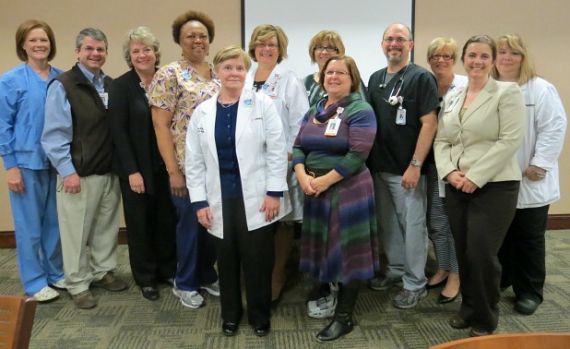
Image resolution: width=570 pixels, height=349 pixels. Identify the location of wall. (3, 219), (124, 19), (465, 16), (565, 203).